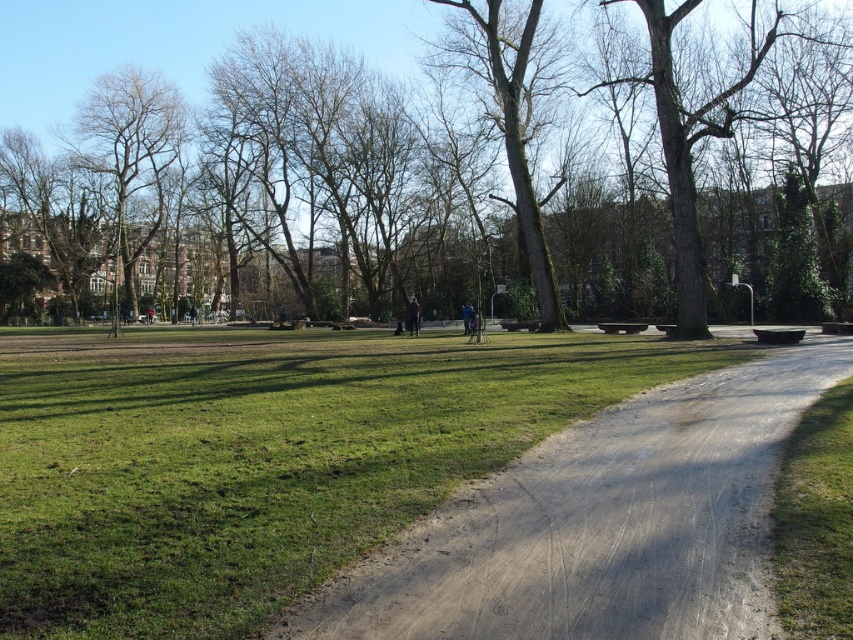
You are a gardener who needs to place a 2m wide decorative stone archway along the dirt path at center. The green mossy bark tree at center is in the way. Can you place the archway without moving the tree?

The dirt path at center is wider than the green mossy bark tree at center, so the archway can be placed on the path as long as it doesn not encroach on the tree.

In the scene shown: You are planning to take a photo of the brown textured tree at center and the bare branches at upper left. Which object should you focus on first if you want to capture both in a single frame without moving the camera?

You should focus on the brown textured tree at center first because it is bigger than the bare branches at upper left, so it will be more prominent in the frame.